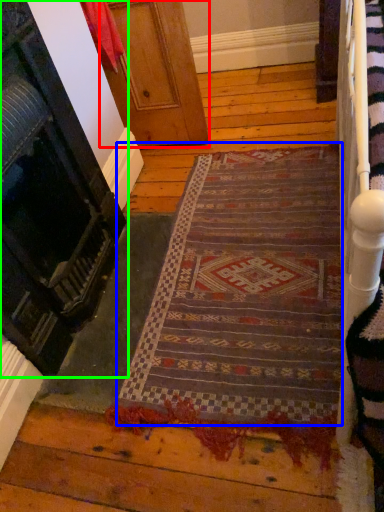
Question: Considering the real-world distances, which object is farthest from door (highlighted by a red box)? mat (highlighted by a blue box) or door (highlighted by a green box)?

Choices:
 (A) mat
 (B) door

Answer: (A)